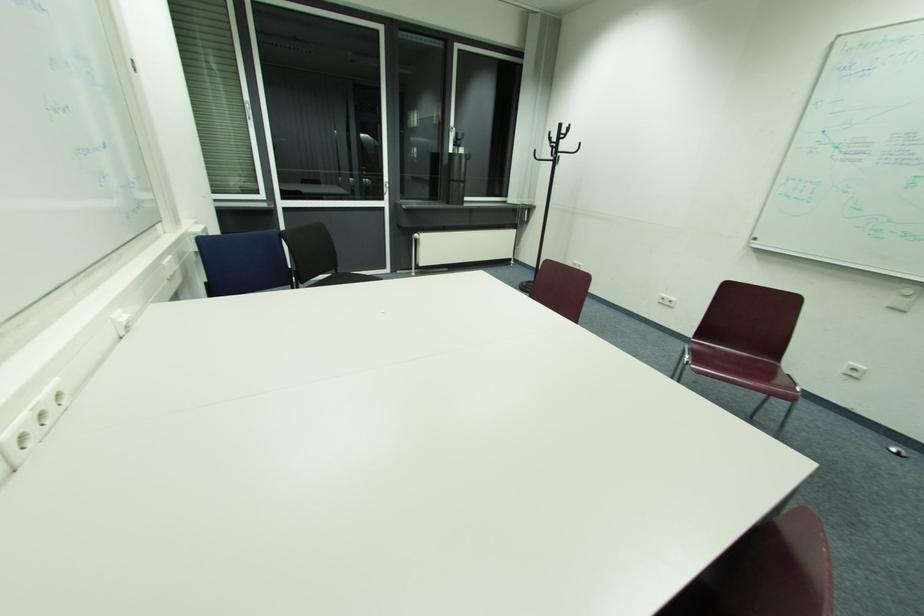
Where is `black coat rack hook`? This screenshot has width=924, height=616. black coat rack hook is located at coordinates (555, 146).